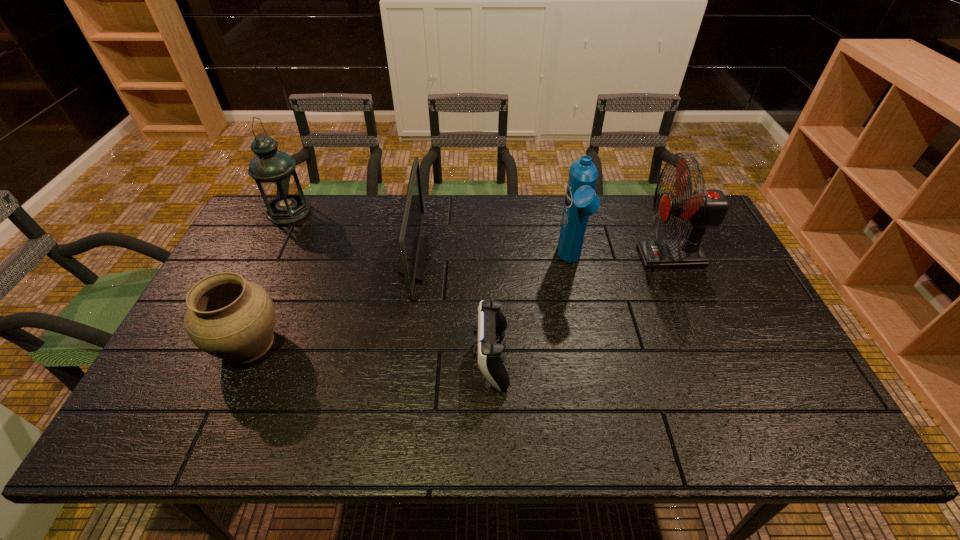
The height and width of the screenshot is (540, 960). I want to click on oil lamp, so click(x=274, y=171).

This screenshot has width=960, height=540. In order to click on fan in this screenshot , I will do `click(704, 208)`.

Locate an element on the screen. This screenshot has height=540, width=960. the second object from right to left is located at coordinates (581, 201).

Where is `the third shortest object`? the third shortest object is located at coordinates (412, 246).

This screenshot has width=960, height=540. Find the location of `the fourth object from right to left`. the fourth object from right to left is located at coordinates (412, 246).

This screenshot has height=540, width=960. Find the location of `urn`. urn is located at coordinates (230, 318).

Identify the location of control. The image size is (960, 540). (490, 319).

Where is `the shortest object`? The image size is (960, 540). the shortest object is located at coordinates click(x=490, y=319).

This screenshot has width=960, height=540. I want to click on free location located on the right of the oil lamp, so click(327, 212).

You are a GUI agent. You are given a task and a screenshot of the screen. Output one action in this format:
    pyautogui.click(x=<x>, y=<y>)
    Task: Click on the vacant space situated 0.370m on the front-facing side of the fan
    This screenshot has width=960, height=540.
    Given the screenshot: What is the action you would take?
    pyautogui.click(x=521, y=257)